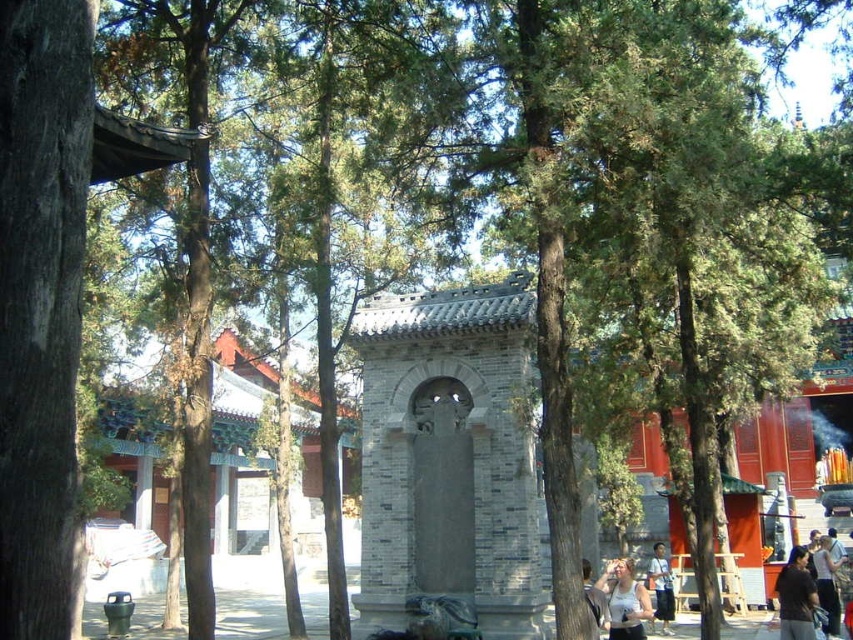
From the picture: You are a photographer standing in the courtyard of a traditional Chinese temple. You notice a person with dark brown hair at lower right and a light blue shirt at center. Which object is taller in the scene?

The dark brown hair at lower right is much taller as light blue shirt at center.